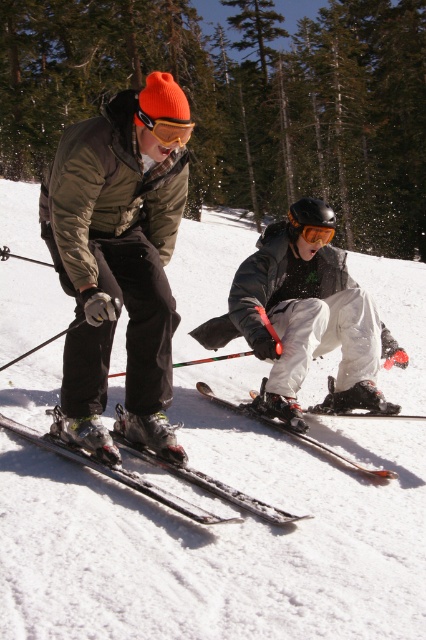
Question: Is matte black ski at left further to the viewer compared to glossy orange goggles at center?

Choices:
 (A) no
 (B) yes

Answer: (A)

Question: Among these objects, which one is nearest to the camera?

Choices:
 (A) shiny metallic skis at center
 (B) shiny black ski at center
 (C) glossy orange goggles at center
 (D) matte black ski at left

Answer: (A)

Question: Is matte black ski at left wider than shiny black ski at center?

Choices:
 (A) no
 (B) yes

Answer: (A)

Question: In this image, where is white matte snow at center located relative to shiny metallic skis at center?

Choices:
 (A) below
 (B) above

Answer: (B)

Question: Which object appears farthest from the camera in this image?

Choices:
 (A) white matte snow at center
 (B) shiny black ski at center
 (C) orange matte/glossy goggles at center
 (D) glossy orange goggles at center

Answer: (D)

Question: Which of the following is the closest to the observer?

Choices:
 (A) matte black ski at left
 (B) orange matte/glossy goggles at center

Answer: (A)